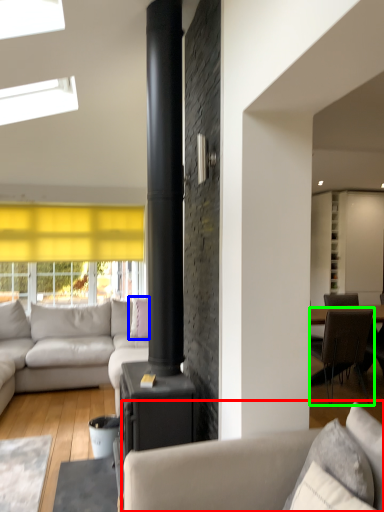
Question: Which object is positioned closest to studio couch (highlighted by a red box)? Select from pillow (highlighted by a blue box) and chair (highlighted by a green box).

Choices:
 (A) pillow
 (B) chair

Answer: (B)